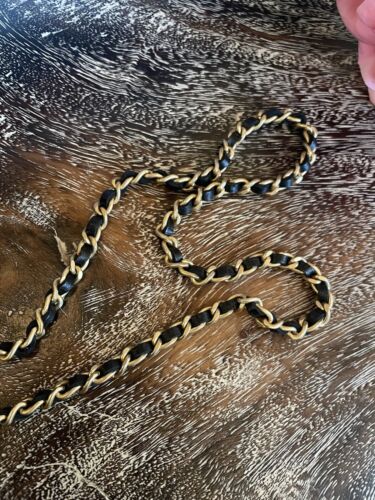
What are the coordinates of `light brown on table` in the screenshot? It's located at (198, 341), (245, 395), (5, 376), (59, 330), (225, 332), (73, 205), (115, 234), (261, 285).